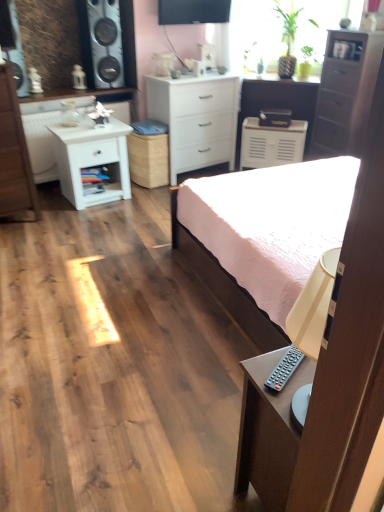
Question: Is white glossy cabinet at upper left inside or outside of white matte cabinet at center?

Choices:
 (A) outside
 (B) inside

Answer: (A)

Question: From the image's perspective, relative to white matte cabinet at center, is white glossy cabinet at upper left above or below?

Choices:
 (A) above
 (B) below

Answer: (A)

Question: Estimate the real-world distances between objects in this image. Which object is closer to the green leafy plant at upper right?

Choices:
 (A) dark brown wooden chest of drawers at upper right, which is counted as the 1th chest of drawers, starting from the right
 (B) metallic silver speaker at upper left
 (C) pink fabric bed at center
 (D) white matte nightstand at left
 (E) white wood chest of drawers at left, which appears as the 3th chest of drawers when viewed from the right

Answer: (A)

Question: Based on their relative distances, which object is farther from the white matte nightstand at left?

Choices:
 (A) white matte vanity at center
 (B) white glossy cabinet at upper left
 (C) pink fabric bed at center
 (D) white matte cabinet at center
 (E) white matte chest of drawers at center, which is the second chest of drawers in left-to-right order

Answer: (A)